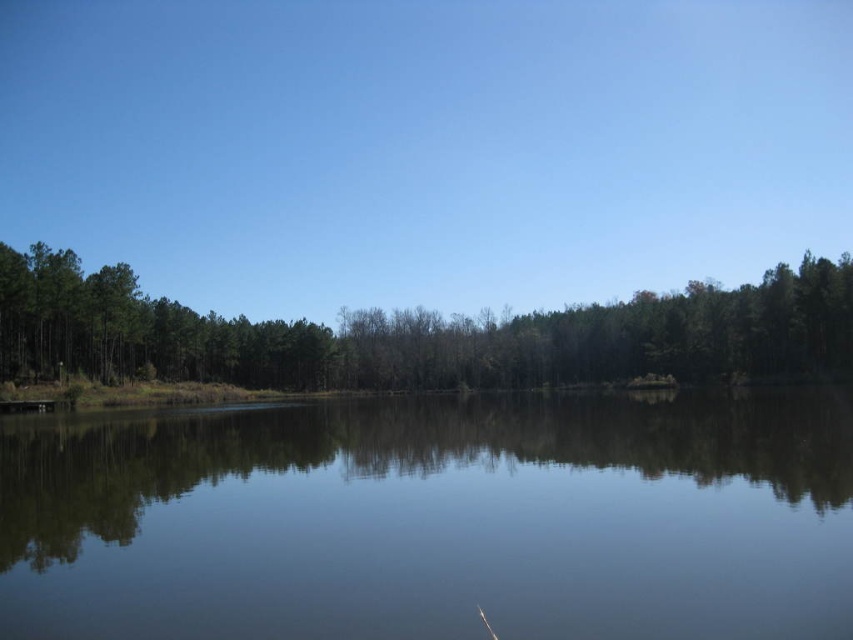
You are a surveyor measuring the distance between two points in the scene. You need to determine if a 50 meter long bridge can be constructed between the clear water at center and the green matte trees at center. Is the distance sufficient?

The clear water at center and green matte trees at center are 50.38 meters apart from each other. Since the bridge is 50 meters long, the distance is sufficient as the span between them is slightly longer than the bridge length.

You are standing at the edge of the lake and see two points in the image. The first point is at coordinates point (793, 596) and the second is at point (154, 316). Which point is nearer to your current position?

Point (793, 596) is closer to the camera than point (154, 316), so the first point is nearer to your current position.